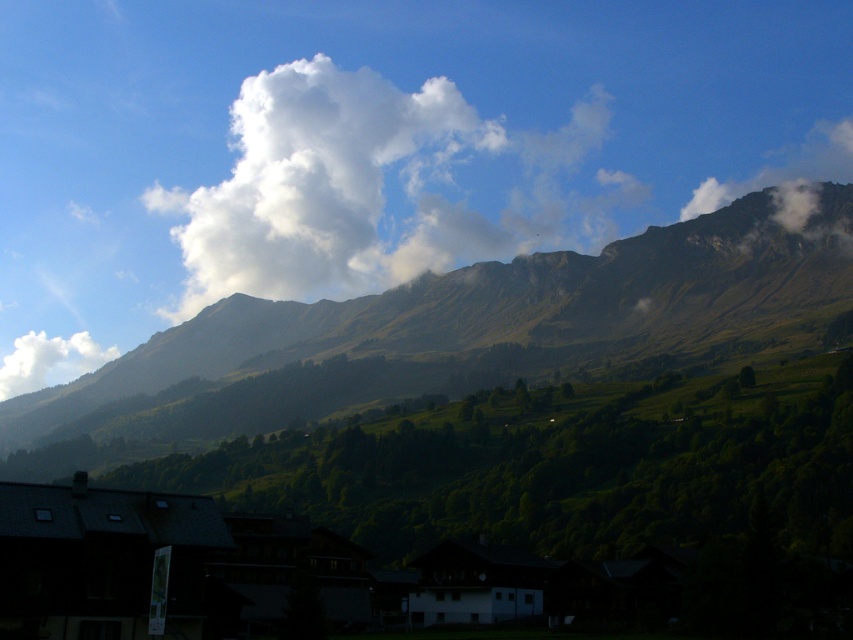
You are standing at the bottom of the mountain and want to reach the highest point of the green grassy mountain at upper center. According to the coordinates provided, what is the exact location of the highest point?

The highest point of the green grassy mountain at upper center is located at coordinates point (473, 385).

You are an airplane passenger looking out the window and see the white fluffy cloud at upper right and the white fluffy cloud at upper left. Which cloud is larger?

The white fluffy cloud at upper right is larger than the white fluffy cloud at upper left.